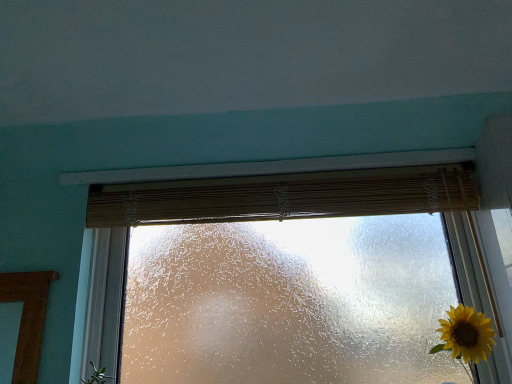
Question: Is bamboo curtain at center outside teal matte wall at upper center?

Choices:
 (A) no
 (B) yes

Answer: (B)

Question: Can you confirm if bamboo curtain at center is taller than teal matte wall at upper center?

Choices:
 (A) no
 (B) yes

Answer: (B)

Question: Can you confirm if bamboo curtain at center is thinner than teal matte wall at upper center?

Choices:
 (A) no
 (B) yes

Answer: (B)

Question: From the image's perspective, would you say bamboo curtain at center is positioned over teal matte wall at upper center?

Choices:
 (A) yes
 (B) no

Answer: (B)

Question: Is bamboo curtain at center to the right of teal matte wall at upper center from the viewer's perspective?

Choices:
 (A) no
 (B) yes

Answer: (B)

Question: Can you confirm if bamboo curtain at center is shorter than teal matte wall at upper center?

Choices:
 (A) yes
 (B) no

Answer: (B)

Question: Can you confirm if teal matte wall at upper center is thinner than bamboo curtain at center?

Choices:
 (A) yes
 (B) no

Answer: (B)

Question: Can you confirm if teal matte wall at upper center is bigger than bamboo curtain at center?

Choices:
 (A) yes
 (B) no

Answer: (A)

Question: Does teal matte wall at upper center lie behind bamboo curtain at center?

Choices:
 (A) no
 (B) yes

Answer: (A)

Question: Does teal matte wall at upper center have a greater height compared to bamboo curtain at center?

Choices:
 (A) yes
 (B) no

Answer: (B)

Question: From a real-world perspective, is teal matte wall at upper center below bamboo curtain at center?

Choices:
 (A) yes
 (B) no

Answer: (B)

Question: Considering the relative sizes of teal matte wall at upper center and bamboo curtain at center in the image provided, is teal matte wall at upper center shorter than bamboo curtain at center?

Choices:
 (A) no
 (B) yes

Answer: (B)

Question: Does teal matte wall at upper center have a smaller size compared to frosted glass window at center?

Choices:
 (A) yes
 (B) no

Answer: (A)